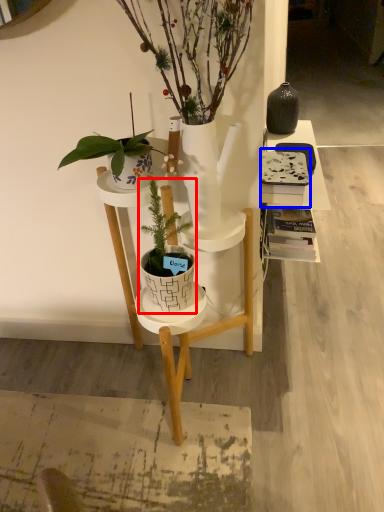
Question: Which of the following is the farthest to the observer, houseplant (highlighted by a red box) or book (highlighted by a blue box)?

Choices:
 (A) houseplant
 (B) book

Answer: (B)